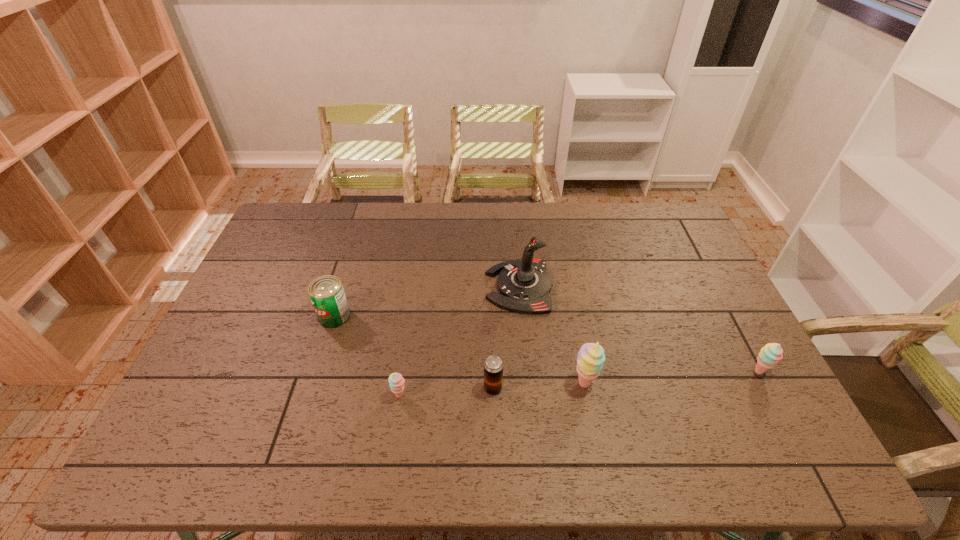
Where is `the shortest sherbert`? the shortest sherbert is located at coordinates (396, 381).

I want to click on the fifth object from right to left, so click(396, 381).

At what (x,y) coordinates should I click in order to perform the action: click on the tallest sherbert. Please return your answer as a coordinate pair (x, y). Image resolution: width=960 pixels, height=540 pixels. Looking at the image, I should click on (590, 358).

Find the location of `the fifth object from left to right`. the fifth object from left to right is located at coordinates (590, 358).

The height and width of the screenshot is (540, 960). I want to click on the second shortest sherbert, so click(x=771, y=353).

The width and height of the screenshot is (960, 540). What are the coordinates of `the rightmost sherbert` in the screenshot? It's located at (771, 353).

The width and height of the screenshot is (960, 540). In order to click on the leftmost object in this screenshot , I will do `click(327, 295)`.

This screenshot has height=540, width=960. What are the coordinates of `joystick` in the screenshot? It's located at (524, 285).

You are a GUI agent. You are given a task and a screenshot of the screen. Output one action in this format:
    pyautogui.click(x=<x>, y=<y>)
    Task: Click on the beer can
    Image resolution: width=960 pixels, height=540 pixels.
    Given the screenshot: What is the action you would take?
    pyautogui.click(x=493, y=366)

The height and width of the screenshot is (540, 960). Identify the location of free point located 0.200m on the back of the shortest sherbert. (410, 328).